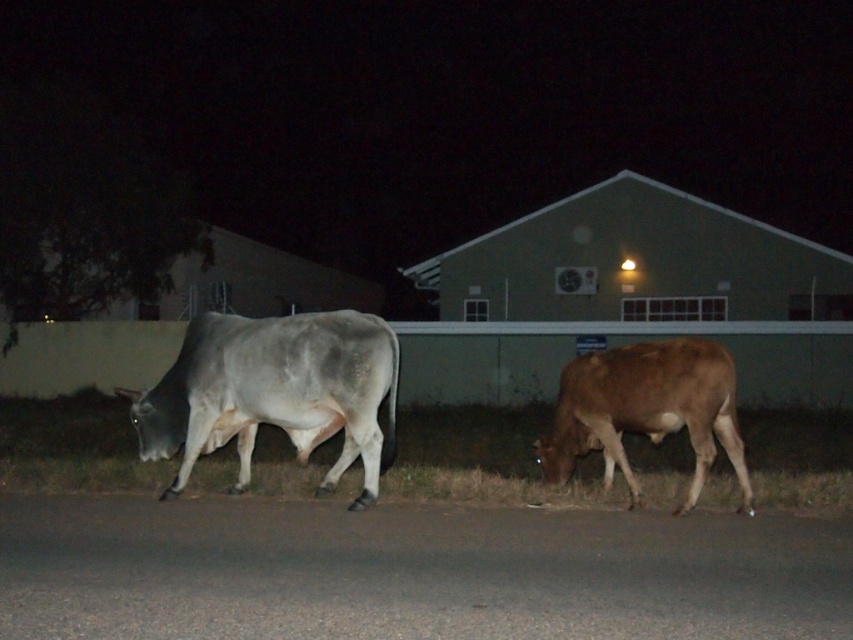
Between green grass at lower center and gray matte cow at center, which one has more height?

With more height is gray matte cow at center.

Which is in front, point (664, 465) or point (259, 404)?

Point (259, 404) is more forward.

The height and width of the screenshot is (640, 853). What are the coordinates of `green grass at lower center` in the screenshot? It's located at (466, 451).

Does point (190, 360) come behind point (740, 486)?

Yes, it is behind point (740, 486).

Is gray matte cow at center positioned before brown matte bull at lower right?

That is False.

Which is in front, point (236, 321) or point (692, 506)?

Positioned in front is point (692, 506).

What are the coordinates of `gray matte cow at center` in the screenshot? It's located at (274, 392).

Does point (834, 474) come behind point (714, 429)?

Yes, point (834, 474) is farther from viewer.

Is green grass at lower center behind brown matte bull at lower right?

Yes.

Is point (357, 476) closer to camera compared to point (697, 378)?

That is False.

Locate an element on the screen. This screenshot has width=853, height=640. green grass at lower center is located at coordinates (466, 451).